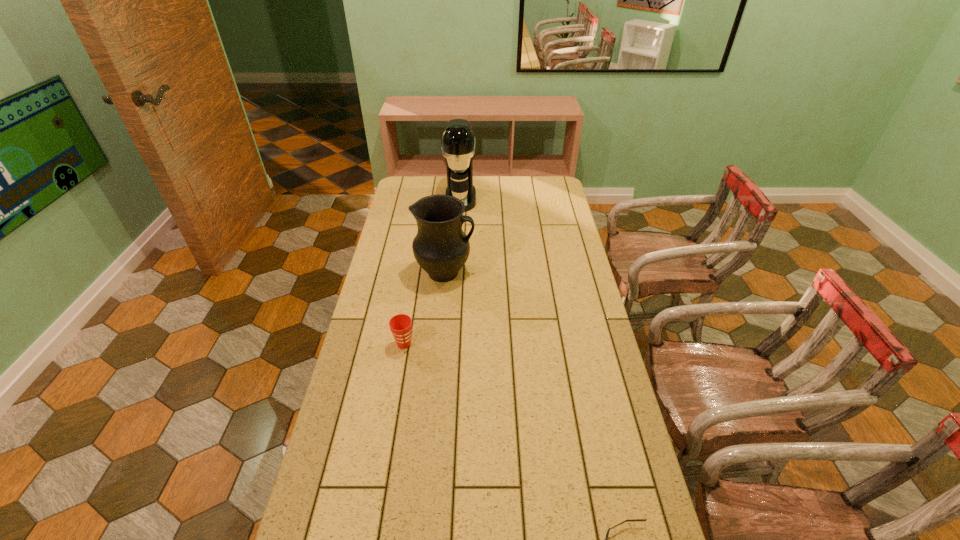
Identify which object is located as the second nearest to the rightmost object. Please provide its 2D coordinates. Your answer should be formatted as a tuple, i.e. [(x, y)], where the tuple contains the x and y coordinates of a point satisfying the conditions above.

[(441, 248)]

Choose which object is the third nearest neighbor to the tallest object. Please provide its 2D coordinates. Your answer should be formatted as a tuple, i.e. [(x, y)], where the tuple contains the x and y coordinates of a point satisfying the conditions above.

[(634, 520)]

Image resolution: width=960 pixels, height=540 pixels. Identify the location of vacant space that satisfies the following two spatial constraints: 1. place cup under the spout of the coffee maker; 2. on the handle side of the third nearest object. (456, 273).

In order to click on free region that satisfies the following two spatial constraints: 1. place cup under the spout of the tallest object; 2. on the handle side of the third nearest object in this screenshot , I will do `click(456, 273)`.